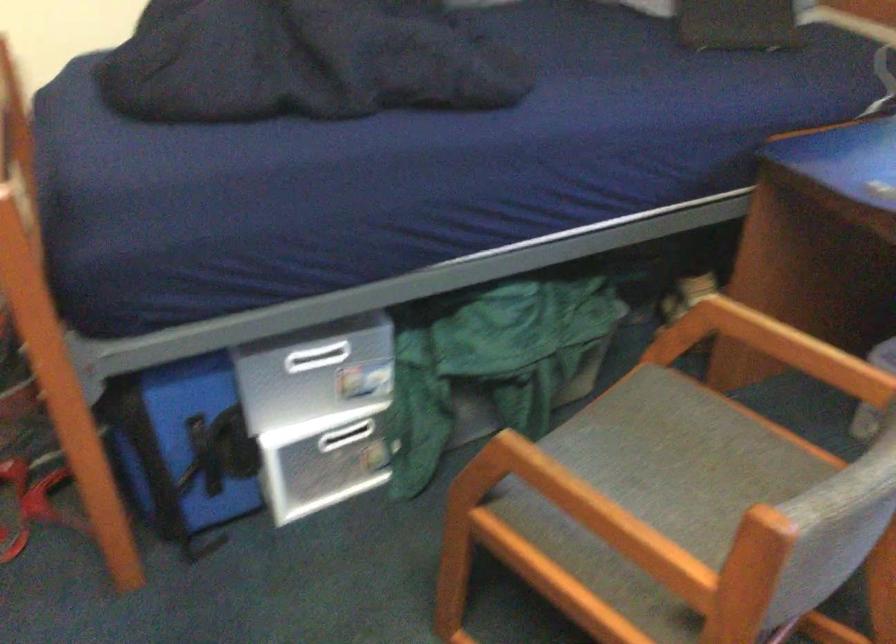
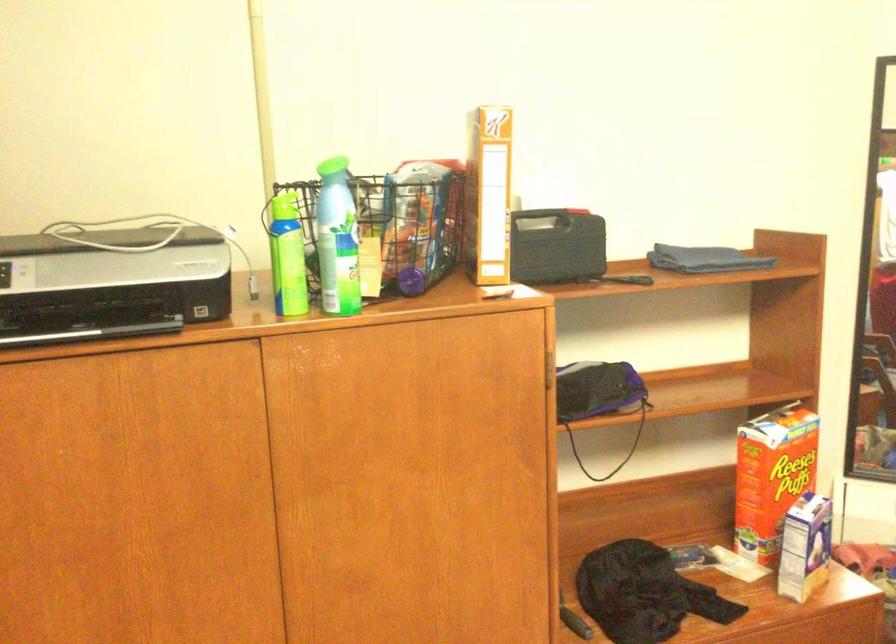
Question: The camera is either moving clockwise (left) or counter-clockwise (right) around the object. The first image is from the beginning of the video and the second image is from the end. Is the camera moving left or right when shooting the video?

Choices:
 (A) Left
 (B) Right

Answer: (B)